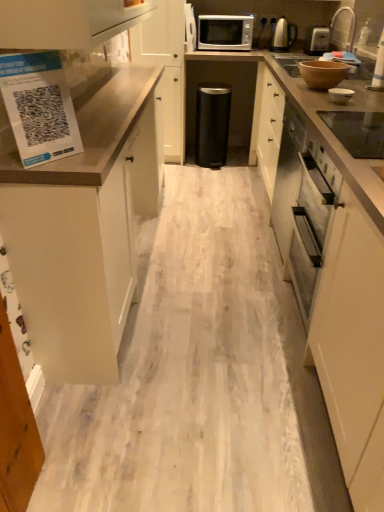
Question: Considering the relative positions of white matte cabinet at center, which ranks as the 2th cabinetry in front-to-back order, and white glossy bowl at upper right, which appears as the second appliance when viewed from the right, in the image provided, is white matte cabinet at center, which ranks as the 2th cabinetry in front-to-back order, to the left or to the right of white glossy bowl at upper right, which appears as the second appliance when viewed from the right,?

Choices:
 (A) right
 (B) left

Answer: (B)

Question: From the image's perspective, relative to white glossy bowl at upper right, which appears as the second appliance when viewed from the right, is white matte cabinet at center, arranged as the first cabinetry when viewed from the back, above or below?

Choices:
 (A) below
 (B) above

Answer: (B)

Question: Which is nearer to the white matte cabinet at center, arranged as the first cabinetry when viewed from the back?

Choices:
 (A) white glossy bowl at upper right, which appears as the 4th appliance when viewed from the left
 (B) satin silver toaster at upper right, which is the first appliance from right to left
 (C) satin silver microwave at upper center
 (D) satin silver kettle at upper right
 (E) brown matte bowl at upper right, the 3th appliance ordered from the bottom

Answer: (C)

Question: Which of these objects is positioned farthest from the black matte trash can at center, the 1th appliance when ordered from left to right?

Choices:
 (A) brown matte countertop at right
 (B) satin silver toaster at upper right, the first appliance viewed from the top
 (C) satin silver microwave at upper center
 (D) black glass cooktop at upper right, which is the 1th appliance from front to back
 (E) white glossy bowl at upper right, acting as the fourth appliance starting from the top

Answer: (D)